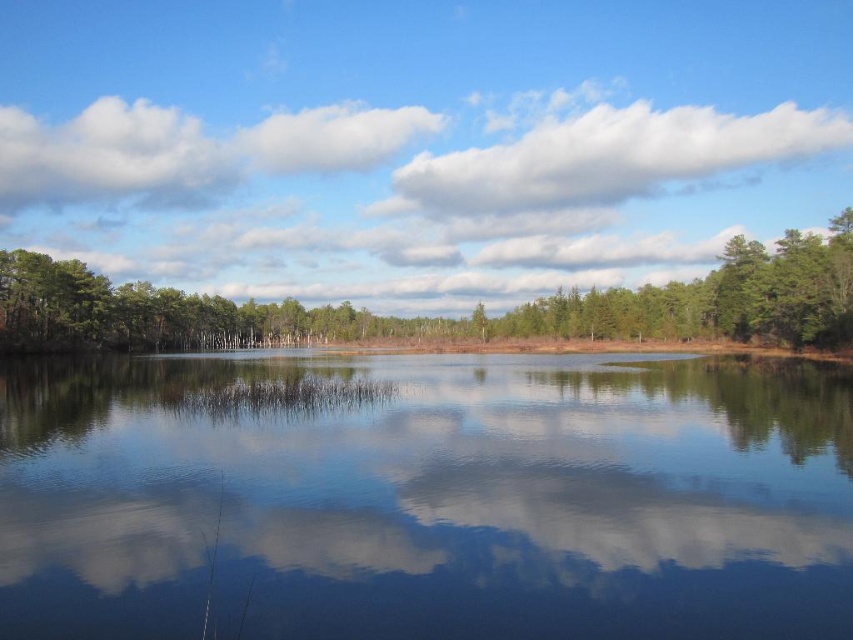
Question: Among these points, which one is nearest to the camera?

Choices:
 (A) (585, 355)
 (B) (323, 336)

Answer: (A)

Question: Which is nearer to the green matte tree at upper center?

Choices:
 (A) white fluffy cloud at upper center
 (B) smooth water at center

Answer: (B)

Question: Is green matte tree at upper center closer to the viewer compared to white fluffy cloud at upper center?

Choices:
 (A) yes
 (B) no

Answer: (A)

Question: Does green matte tree at upper center appear on the right side of white fluffy cloud at upper center?

Choices:
 (A) yes
 (B) no

Answer: (B)

Question: Among these points, which one is nearest to the camera?

Choices:
 (A) (834, 116)
 (B) (825, 339)
 (C) (740, 531)

Answer: (C)

Question: Is the position of smooth water at center more distant than that of green matte tree at upper center?

Choices:
 (A) yes
 (B) no

Answer: (B)